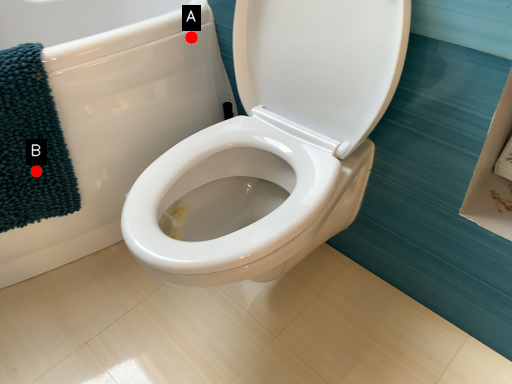
Question: Two points are circled on the image, labeled by A and B beside each circle. Which point is further to the camera?

Choices:
 (A) A is further
 (B) B is further

Answer: (A)